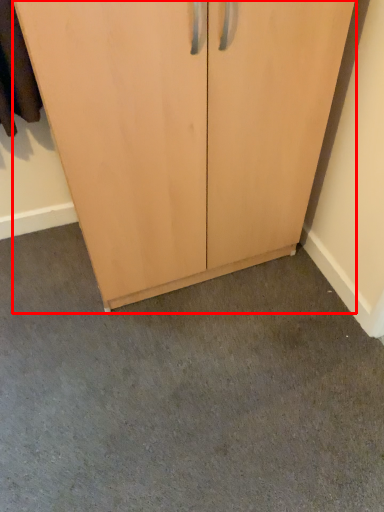
Question: Considering the relative positions of cupboard (annotated by the red box) and concrete in the image provided, where is cupboard (annotated by the red box) located with respect to the staircase?

Choices:
 (A) left
 (B) right

Answer: (A)